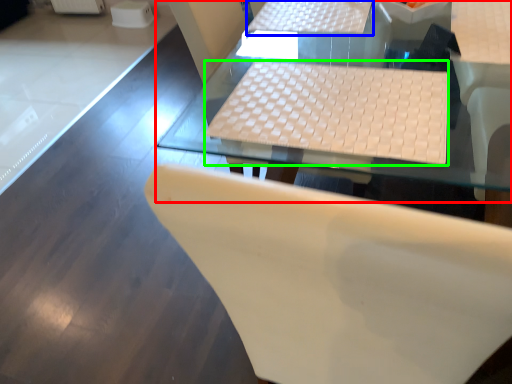
Question: Considering the real-world distances, which object is closest to table (highlighted by a red box)? table (highlighted by a blue box) or laptop keyboard (highlighted by a green box).

Choices:
 (A) table
 (B) laptop keyboard

Answer: (B)